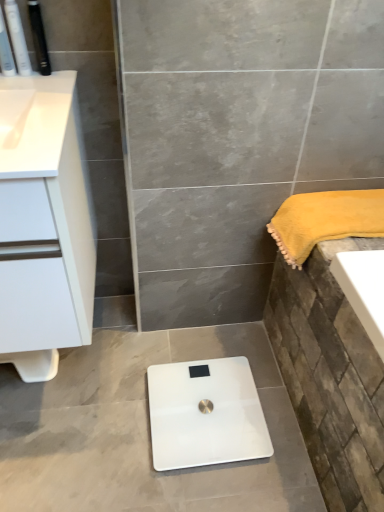
Question: Could you tell me if white matte cabinet at left is turned towards matte black toothbrush at upper left, the third toiletry positioned from the right?

Choices:
 (A) no
 (B) yes

Answer: (A)

Question: Considering the relative positions of white matte cabinet at left and matte black toothbrush at upper left, positioned as the first toiletry in left-to-right order, in the image provided, is white matte cabinet at left to the left of matte black toothbrush at upper left, positioned as the first toiletry in left-to-right order, from the viewer's perspective?

Choices:
 (A) yes
 (B) no

Answer: (B)

Question: Is white matte cabinet at left thinner than matte black toothbrush at upper left, the third toiletry positioned from the right?

Choices:
 (A) no
 (B) yes

Answer: (A)

Question: Is white matte cabinet at left further to camera compared to matte black toothbrush at upper left, positioned as the first toiletry in left-to-right order?

Choices:
 (A) no
 (B) yes

Answer: (A)

Question: From the image's perspective, does white matte cabinet at left appear higher than matte black toothbrush at upper left, the third toiletry positioned from the right?

Choices:
 (A) yes
 (B) no

Answer: (B)

Question: Considering the positions of matte black toothbrush at upper left, positioned as the first toiletry in left-to-right order, and white glossy scale at center in the image, is matte black toothbrush at upper left, positioned as the first toiletry in left-to-right order, wider or thinner than white glossy scale at center?

Choices:
 (A) wide
 (B) thin

Answer: (B)

Question: In terms of size, does matte black toothbrush at upper left, the third toiletry positioned from the right, appear bigger or smaller than white glossy scale at center?

Choices:
 (A) big
 (B) small

Answer: (B)

Question: From the image's perspective, is matte black toothbrush at upper left, positioned as the first toiletry in left-to-right order, positioned above or below white glossy scale at center?

Choices:
 (A) above
 (B) below

Answer: (A)

Question: Which is correct: matte black toothbrush at upper left, positioned as the first toiletry in left-to-right order, is inside white glossy scale at center, or outside of it?

Choices:
 (A) outside
 (B) inside

Answer: (A)

Question: Is white matte cabinet at left in front of or behind matte black toothbrush at upper left, positioned as the first toiletry in left-to-right order, in the image?

Choices:
 (A) front
 (B) behind

Answer: (A)

Question: Based on their sizes in the image, would you say white matte cabinet at left is bigger or smaller than matte black toothbrush at upper left, the third toiletry positioned from the right?

Choices:
 (A) small
 (B) big

Answer: (B)

Question: Is white matte cabinet at left taller or shorter than matte black toothbrush at upper left, positioned as the first toiletry in left-to-right order?

Choices:
 (A) tall
 (B) short

Answer: (A)

Question: From the image's perspective, is white matte cabinet at left positioned above or below matte black toothbrush at upper left, the third toiletry positioned from the right?

Choices:
 (A) above
 (B) below

Answer: (B)

Question: From the image's perspective, is white plastic toothbrushes at upper left, acting as the second toiletry starting from the right, above or below white glossy scale at center?

Choices:
 (A) below
 (B) above

Answer: (B)

Question: From a real-world perspective, is white plastic toothbrushes at upper left, acting as the second toiletry starting from the right, above or below white glossy scale at center?

Choices:
 (A) above
 (B) below

Answer: (A)